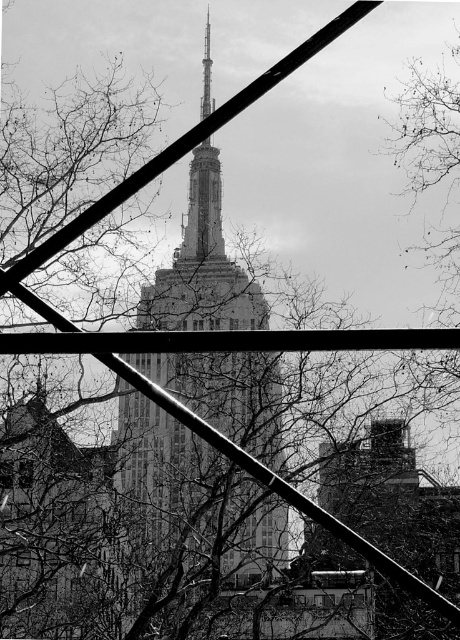
Is point (18, 467) farther from camera compared to point (316, 593)?

That is True.

At what (x,y) coordinates should I click in order to perform the action: click on transparent glass window at lower left. Please return your answer as a coordinate pair (x, y). This screenshot has width=460, height=640. Looking at the image, I should click on (26, 474).

Does point (29, 483) come in front of point (317, 595)?

That is False.

Identify the location of transparent glass window at lower left. (26, 474).

Who is shorter, smooth stone tower at center or transparent glass window at lower left?

transparent glass window at lower left

Is smooth stone tower at center taller than transparent glass window at lower left?

Yes, smooth stone tower at center is taller than transparent glass window at lower left.

At what (x,y) coordinates should I click in order to perform the action: click on smooth stone tower at center. Please return your answer as a coordinate pair (x, y). Looking at the image, I should click on (202, 266).

Image resolution: width=460 pixels, height=640 pixels. I want to click on smooth stone tower at center, so click(x=202, y=266).

Between smooth stone tower at center and transparent glass window at lower center, which one appears on the right side from the viewer's perspective?

Positioned to the right is transparent glass window at lower center.

Who is taller, smooth stone tower at center or transparent glass window at lower center?

smooth stone tower at center

Does point (212, 60) come in front of point (327, 602)?

No, (212, 60) is further to viewer.

You are a GUI agent. You are given a task and a screenshot of the screen. Output one action in this format:
    pyautogui.click(x=<x>, y=<y>)
    Task: Click on the smooth stone tower at center
    
    Given the screenshot: What is the action you would take?
    pyautogui.click(x=202, y=266)